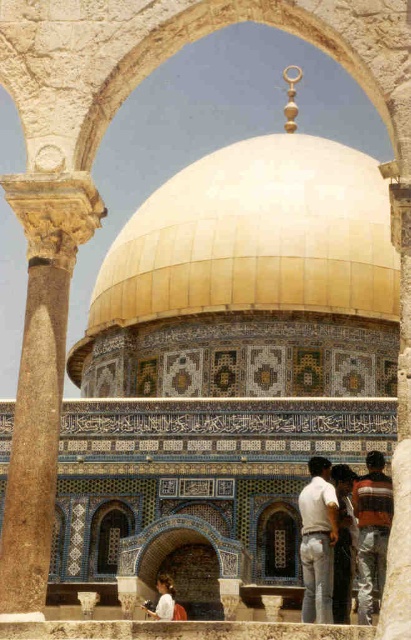
You are standing in front of the Dome of the Rock and want to take a photo that includes both the gold mosaic dome at center and the brown stone column at left. If your camera has a maximum focus range of 100 feet, will you be able to capture both objects in the same frame?

The gold mosaic dome at center is 107.02 feet away from the brown stone column at left. Since the distance between them exceeds the camera maximum focus range of 100 feet, you won wait be able to capture both objects in the same frame.

You are standing in front of the Dome of the Rock and want to take a photo of the gold mosaic dome at center. Where should you aim your camera to capture it?

You should aim your camera at point [240,257] to capture the gold mosaic dome at center.

You are a photographer standing in front of the Dome of the Rock. You notice the gold mosaic dome at center and the white cotton shirt at lower center in your viewfinder. Which object appears wider in the image?

The gold mosaic dome at center appears wider than the white cotton shirt at lower center because its width surpasses that of the shirt.